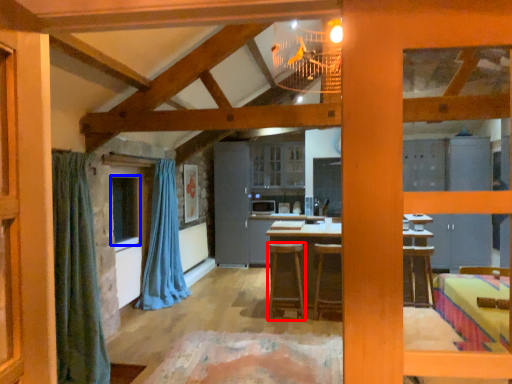
Question: Which of the following is the closest to the observer, stool (highlighted by a red box) or window (highlighted by a blue box)?

Choices:
 (A) stool
 (B) window

Answer: (B)